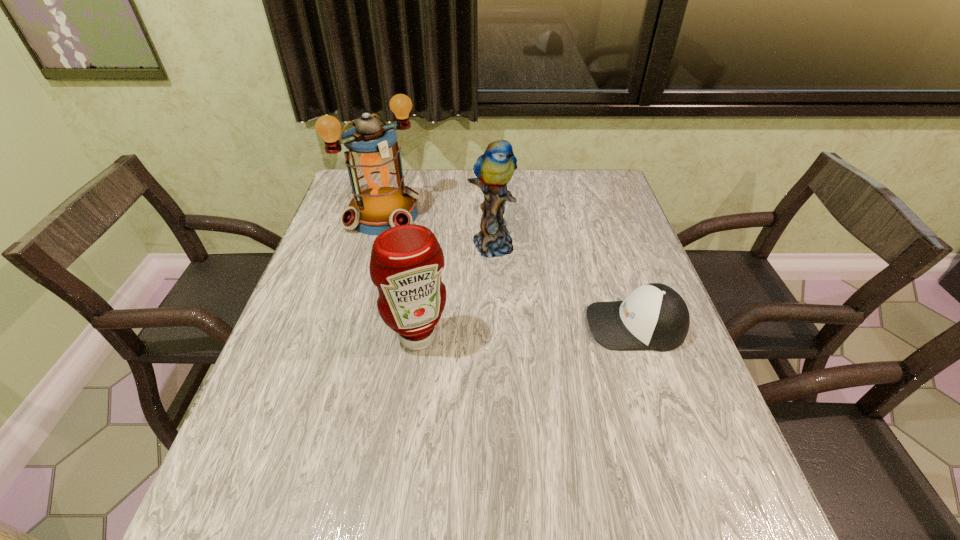
This screenshot has height=540, width=960. In order to click on the third tallest object in this screenshot , I will do `click(406, 263)`.

You are a GUI agent. You are given a task and a screenshot of the screen. Output one action in this format:
    pyautogui.click(x=<x>, y=<y>)
    Task: Click on the cap
    
    Given the screenshot: What is the action you would take?
    pyautogui.click(x=654, y=316)

The image size is (960, 540). Find the location of `the rightmost object`. the rightmost object is located at coordinates (654, 316).

This screenshot has width=960, height=540. What are the coordinates of `lantern` in the screenshot? It's located at (381, 200).

Where is `parrot`? The image size is (960, 540). parrot is located at coordinates (494, 169).

Identify the location of free location located 0.160m on the back of the third tallest object. (426, 273).

Locate an element on the screen. free space located on the front panel of the shortest object is located at coordinates (557, 325).

Image resolution: width=960 pixels, height=540 pixels. I want to click on free space located on the front panel of the shortest object, so click(x=535, y=325).

You are a GUI agent. You are given a task and a screenshot of the screen. Output one action in this format:
    pyautogui.click(x=<x>, y=<y>)
    Task: Click on the vacant area situated on the front panel of the shortest object
    
    Given the screenshot: What is the action you would take?
    pyautogui.click(x=448, y=325)

What are the coordinates of `vacant region located on the front-facing side of the lantern` in the screenshot? It's located at (443, 265).